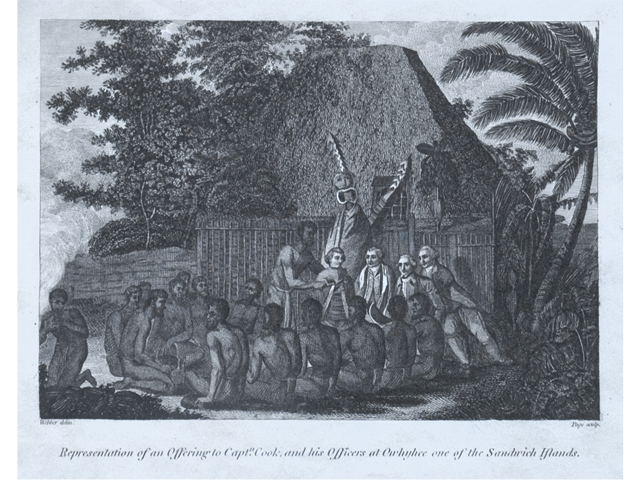
I want to click on brick or stone wall, so click(x=132, y=269).